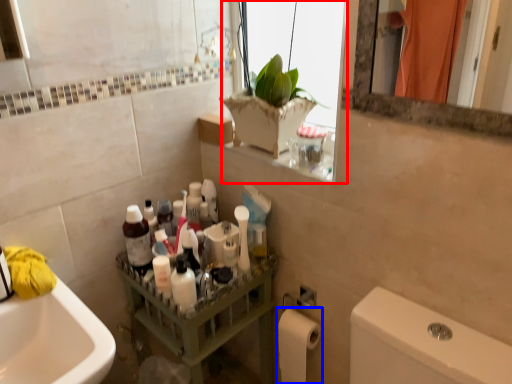
Question: Among these objects, which one is farthest to the camera, window (highlighted by a red box) or toilet paper (highlighted by a blue box)?

Choices:
 (A) window
 (B) toilet paper

Answer: (B)